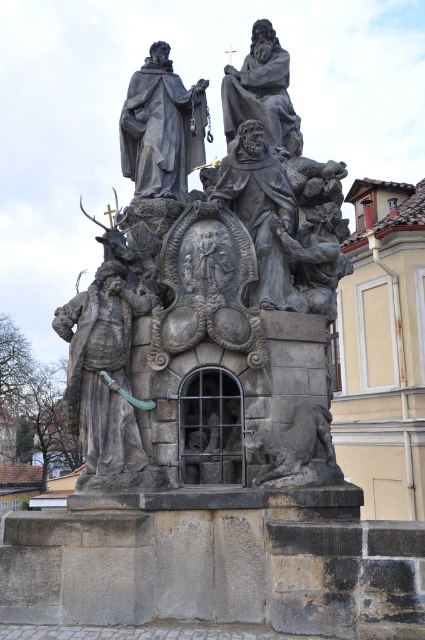
Based on the coordinates provided in the Objects Description, where is the polished stone statue at center positioned in the image?

The polished stone statue at center is located at point coordinates of (x=209, y=296).

You are an art historian examining the sculpture from a distance. You notice two key elements labeled as the polished stone statue at center and the polished stone figure at center. Based on their positions, which one is closer to your viewpoint?

The polished stone statue at center is closer to your viewpoint because it is in front of the polished stone figure at center.

You are an art conservator assessing the dimensions of the sculpture components. Which object has a greater width between the polished bronze figure at lower left and the polished stone figure at center?

The polished bronze figure at lower left has a greater width than the polished stone figure at center according to the description.